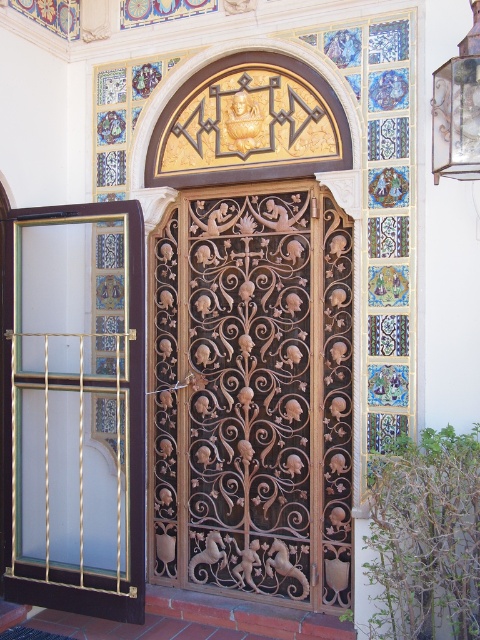
You are trying to enter through the entrance and see the brown wrought iron door at center and the frosted glass screen door at left. Which door should you use if you want to go through the narrower opening?

You should use the brown wrought iron door at center because it occupies less space than the frosted glass screen door at left, making it the narrower opening.

You are a delivery person trying to enter through the entrance. You see the brown wrought iron door at center and the frosted glass screen door at left. Which door should you open first?

The brown wrought iron door at center is positioned over the frosted glass screen door at left, so you should open the frosted glass screen door at left first before accessing the brown wrought iron door at center.

You are standing in front of the entrance door and want to touch the point at coordinates point (294, 412). Can you reach it without moving your position?

The point (294, 412) is 4.25 meters away from you, so you cannot reach it without moving closer.